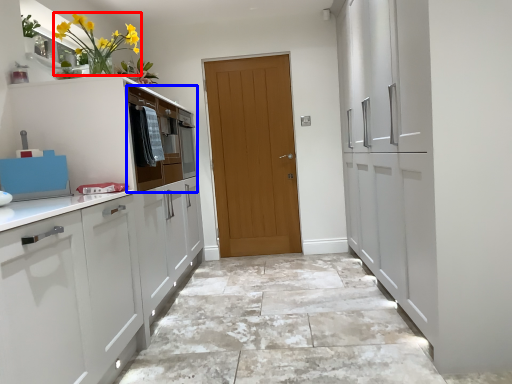
Question: Which object appears farthest to the camera in this image, floral arrangement (highlighted by a red box) or drawer (highlighted by a blue box)?

Choices:
 (A) floral arrangement
 (B) drawer

Answer: (B)